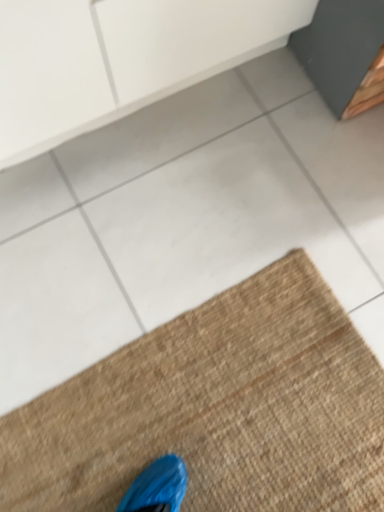
What do you see at coordinates (216, 409) in the screenshot? I see `brown textured mat at lower right` at bounding box center [216, 409].

The width and height of the screenshot is (384, 512). What are the coordinates of `brown textured mat at lower right` in the screenshot? It's located at (216, 409).

I want to click on brown textured mat at lower right, so click(x=216, y=409).